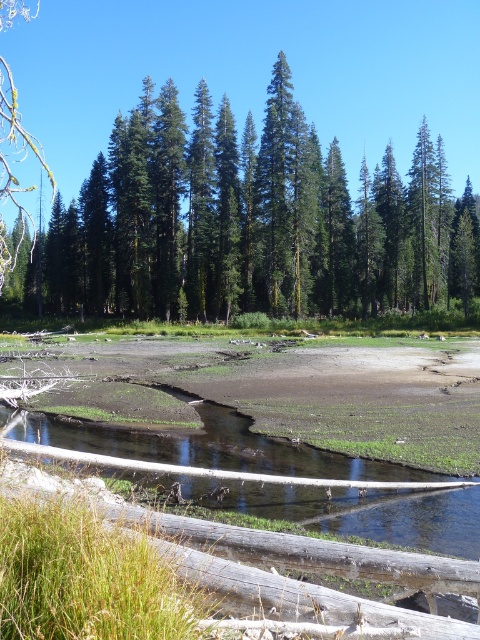
Which is behind, point (196, 196) or point (280, 506)?

The point (196, 196) is more distant.

Which is behind, point (194, 188) or point (274, 484)?

The point (194, 188) is more distant.

Find the location of `green matte tree at center`. green matte tree at center is located at coordinates (245, 224).